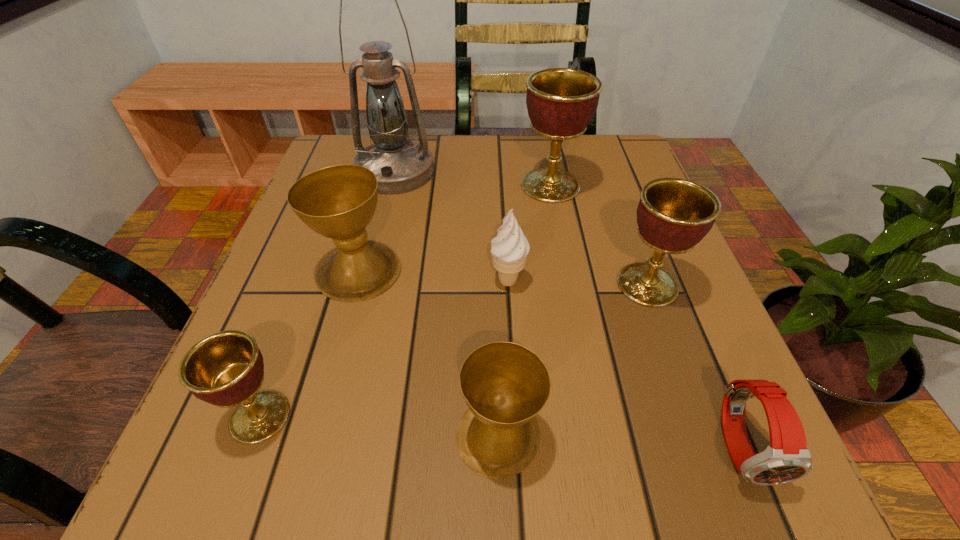
I want to click on vacant space at the far edge of the desktop, so click(486, 153).

Find the location of a particular element. The height and width of the screenshot is (540, 960). free spot at the near edge of the desktop is located at coordinates (563, 500).

Identify the location of vacant space at the left edge of the desktop. This screenshot has height=540, width=960. (339, 308).

At what (x,y) coordinates should I click in order to perform the action: click on blank space at the right edge of the desktop. Please return your answer as a coordinate pair (x, y). Looking at the image, I should click on (598, 211).

This screenshot has width=960, height=540. Identify the location of free region at the far left corner of the desktop. (334, 151).

The image size is (960, 540). What are the coordinates of `vacant space at the far right corner of the desktop` in the screenshot? It's located at (607, 168).

The width and height of the screenshot is (960, 540). I want to click on free area in between the second biggest golden chalice and the tallest object, so click(x=521, y=228).

This screenshot has width=960, height=540. Identify the location of free space between the shortest object and the nearer brown chalice. (619, 442).

You are a GUI agent. You are given a task and a screenshot of the screen. Output one action in this format:
    pyautogui.click(x=<x>, y=<y>)
    Task: Click on the vacant area that lies between the seventh shortest object and the icecream
    The image size is (960, 540).
    Given the screenshot: What is the action you would take?
    pyautogui.click(x=529, y=233)

You are a GUI agent. You are given a task and a screenshot of the screen. Output one action in this format:
    pyautogui.click(x=<x>, y=<y>)
    Task: Click on the vacant space in between the smaller brown chalice and the left brown chalice
    The image size is (960, 540).
    Given the screenshot: What is the action you would take?
    pyautogui.click(x=429, y=354)